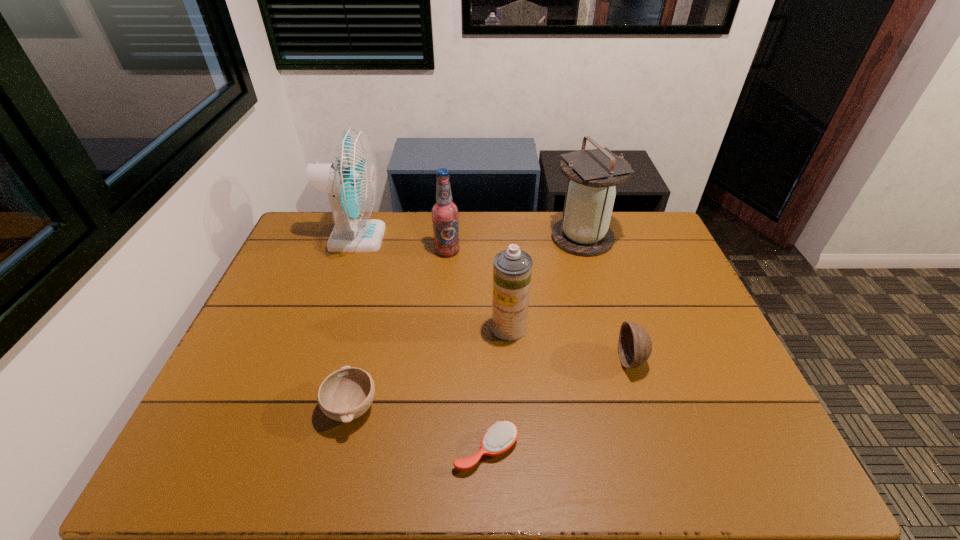
I want to click on object situated at the left edge, so click(x=351, y=180).

This screenshot has width=960, height=540. In order to click on object that is at the far left corner in this screenshot , I will do `click(351, 180)`.

What are the coordinates of `vacant space at the near edge` in the screenshot? It's located at (252, 474).

The height and width of the screenshot is (540, 960). What are the coordinates of `free space at the left edge` in the screenshot? It's located at (283, 316).

You are a GUI agent. You are given a task and a screenshot of the screen. Output one action in this format:
    pyautogui.click(x=<x>, y=<y>)
    Task: Click on the free region at the right edge
    This screenshot has width=960, height=540.
    Given the screenshot: What is the action you would take?
    pyautogui.click(x=631, y=259)

The height and width of the screenshot is (540, 960). In order to click on free space at the far right corner in this screenshot , I will do click(x=626, y=249).

In the image, there is a desktop. Identify the location of vacant space at the near right corner. This screenshot has width=960, height=540. (716, 453).

I want to click on vacant area between the hairbrush and the fan, so click(421, 344).

Where is `free space between the alcohol and the fourth nearest object`? The height and width of the screenshot is (540, 960). free space between the alcohol and the fourth nearest object is located at coordinates (478, 289).

I want to click on empty space that is in between the nearer bowl and the fifth object from right to left, so click(x=399, y=329).